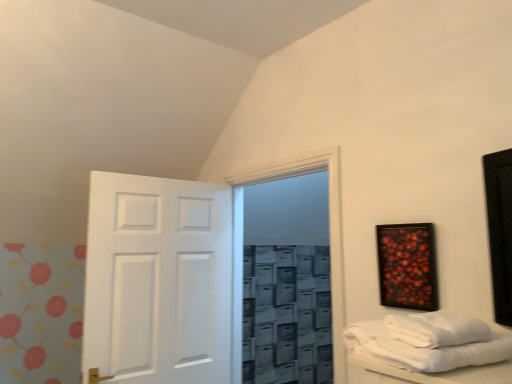
In order to click on white matte door at center in this screenshot , I will do `click(158, 281)`.

Locate an element on the screen. This screenshot has height=384, width=512. white towel at lower right is located at coordinates (436, 329).

I want to click on white matte door at center, so click(x=158, y=281).

From the image's perspective, is white matte door at center over white cotton towels at right?

Actually, white matte door at center appears below white cotton towels at right in the image.

Can you confirm if white matte door at center is taller than white cotton towels at right?

Yes, white matte door at center is taller than white cotton towels at right.

Can you tell me how much white matte door at center and white cotton towels at right differ in facing direction?

99.7 degrees.

Could you tell me if white matte door at center is turned towards white cotton towels at right?

Yes.

Looking at this image, is white towel at lower right smaller than wooden-framed artwork at upper right?

No, white towel at lower right is not smaller than wooden-framed artwork at upper right.

Is point (396, 320) positioned in front of point (407, 225)?

Yes, point (396, 320) is in front of point (407, 225).

Looking at their sizes, would you say white towel at lower right is wider or thinner than wooden-framed artwork at upper right?

white towel at lower right is wider than wooden-framed artwork at upper right.

From a real-world perspective, between white towel at lower right and wooden-framed artwork at upper right, who is vertically lower?

white towel at lower right.

Considering the sizes of white matte door at center and white towel at lower right in the image, is white matte door at center bigger or smaller than white towel at lower right?

white matte door at center is bigger than white towel at lower right.

Which object is closer to the camera taking this photo, white matte door at center or white towel at lower right?

white towel at lower right is more forward.

From the picture: Measure the distance between white matte door at center and white towel at lower right.

white matte door at center is 1.46 meters from white towel at lower right.

Is white matte door at center thinner than white towel at lower right?

Yes.

Can you tell me how much white towel at lower right and white matte door at center differ in facing direction?

white towel at lower right and white matte door at center are facing 104 degrees away from each other.

Consider the image. Would you consider white towel at lower right to be distant from white matte door at center?

Yes, white towel at lower right is far from white matte door at center.

From the image's perspective, who appears lower, white towel at lower right or white matte door at center?

white matte door at center is shown below in the image.

Which object is thinner, white towel at lower right or white matte door at center?

Thinner between the two is white matte door at center.

From the image's perspective, is white matte door at center located above or below transparent glass door at center?

white matte door at center is situated lower than transparent glass door at center in the image.

From a real-world perspective, is white matte door at center above or below transparent glass door at center?

In terms of real-world spatial position, white matte door at center is below transparent glass door at center.

Is white matte door at center with transparent glass door at center?

white matte door at center is not next to transparent glass door at center, and they're not touching.

Where is `door below the transparent glass door at center (from a real-world perspective)`? This screenshot has width=512, height=384. door below the transparent glass door at center (from a real-world perspective) is located at coordinates (158, 281).

Is white cotton towels at right turned away from white towel at lower right?

No, white cotton towels at right is not facing the opposite direction of white towel at lower right.

Would you say white cotton towels at right is inside or outside white towel at lower right?

The correct answer is: outside.

Consider the image. From a real-world perspective, is white cotton towels at right under white towel at lower right?

Correct, in the physical world, white cotton towels at right is lower than white towel at lower right.

From the image's perspective, is white cotton towels at right under white towel at lower right?

Yes, from the image's perspective, white cotton towels at right is beneath white towel at lower right.

From the image's perspective, is white towel at lower right located above transparent glass door at center?

Indeed, from the image's perspective, white towel at lower right is shown above transparent glass door at center.

Between point (451, 334) and point (339, 366), which one is positioned behind?

The point (339, 366) is farther from the camera.

In the image, is white towel at lower right positioned in front of or behind transparent glass door at center?

Visually, white towel at lower right is located in front of transparent glass door at center.

Considering the relative sizes of white towel at lower right and transparent glass door at center in the image provided, is white towel at lower right shorter than transparent glass door at center?

Yes, white towel at lower right is shorter than transparent glass door at center.

I want to click on door on the left of white cotton towels at right, so click(x=158, y=281).

The image size is (512, 384). Find the location of `picture frame lying above the white towel at lower right (from the image's perspective)`. picture frame lying above the white towel at lower right (from the image's perspective) is located at coordinates (407, 266).

Based on their spatial positions, is white matte door at center or transparent glass door at center further from white cotton towels at right?

Based on the image, white matte door at center appears to be further to white cotton towels at right.

From the image, which object appears to be farther from white towel at lower right, transparent glass door at center or white cotton towels at right?

transparent glass door at center is positioned further to the anchor white towel at lower right.

From the image, which object appears to be nearer to white towel at lower right, white cotton towels at right or transparent glass door at center?

white cotton towels at right lies closer to white towel at lower right than the other object.

Based on their spatial positions, is white matte door at center or white towel at lower right further from transparent glass door at center?

Based on the image, white towel at lower right appears to be further to transparent glass door at center.

Looking at the image, which one is located closer to white towel at lower right, wooden-framed artwork at upper right or white cotton towels at right?

white cotton towels at right is closer to white towel at lower right.

When comparing their distances from transparent glass door at center, does white cotton towels at right or wooden-framed artwork at upper right seem closer?

wooden-framed artwork at upper right is positioned closer to the anchor transparent glass door at center.

Based on their spatial positions, is white towel at lower right or transparent glass door at center closer to white matte door at center?

transparent glass door at center lies closer to white matte door at center than the other object.

Looking at the image, which one is located further to white towel at lower right, white matte door at center or wooden-framed artwork at upper right?

white matte door at center.

Where is `material between white cotton towels at right and wooden-framed artwork at upper right along the z-axis`? material between white cotton towels at right and wooden-framed artwork at upper right along the z-axis is located at coordinates tap(436, 329).

At what (x,y) coordinates should I click in order to perform the action: click on glass door situated between white matte door at center and wooden-framed artwork at upper right from left to right. Please return your answer as a coordinate pair (x, y). This screenshot has width=512, height=384. Looking at the image, I should click on (330, 245).

This screenshot has height=384, width=512. I want to click on material between white cotton towels at right and white matte door at center from front to back, so coord(436,329).

This screenshot has height=384, width=512. In order to click on glass door positioned between white cotton towels at right and white matte door at center from near to far in this screenshot , I will do `click(330, 245)`.